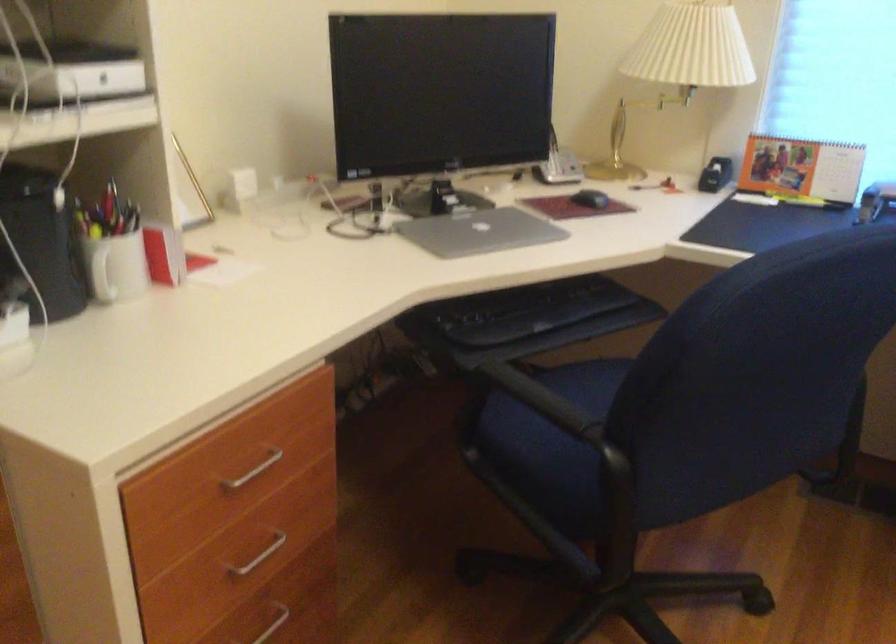
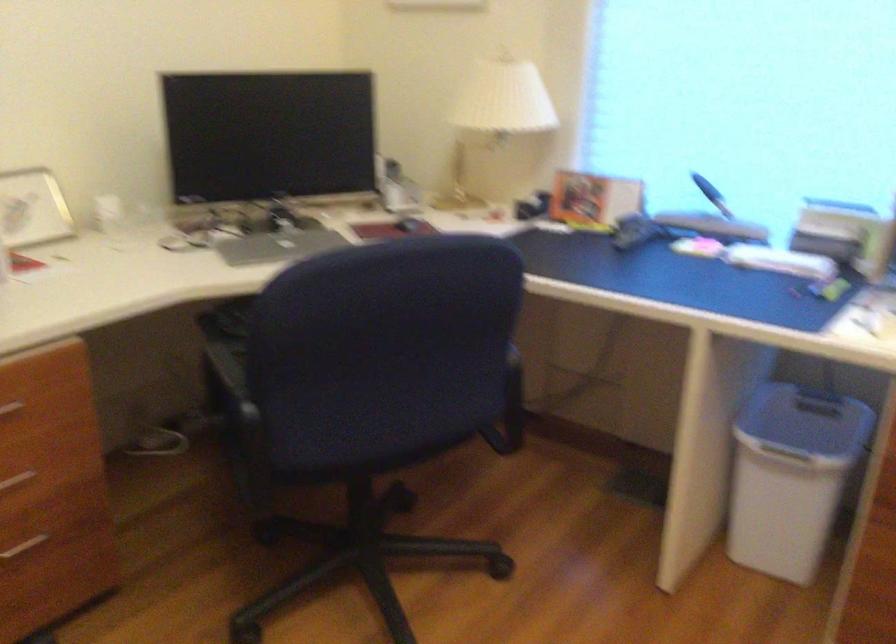
Question: How did the camera likely rotate?

Choices:
 (A) Left
 (B) Right
 (C) Up
 (D) Down

Answer: (A)